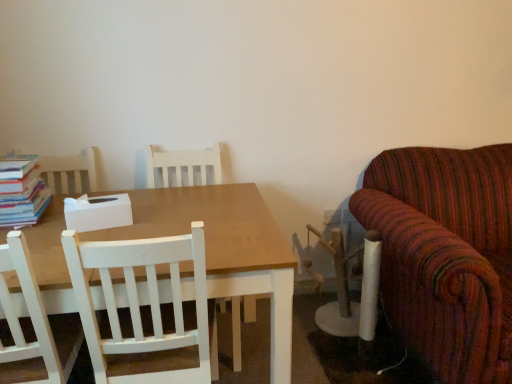
Locate an element on the screen. white wood chair at center, which is counted as the 2th chair, starting from the back is located at coordinates (146, 311).

This screenshot has width=512, height=384. What do you see at coordinates (22, 191) in the screenshot? I see `hardcover books at left` at bounding box center [22, 191].

The height and width of the screenshot is (384, 512). What do you see at coordinates (183, 164) in the screenshot?
I see `white wood chair at center, the first chair when ordered from back to front` at bounding box center [183, 164].

This screenshot has width=512, height=384. I want to click on white wood chair at center, marked as the first chair in a front-to-back arrangement, so click(x=146, y=311).

How distant is hardcover books at left from white wood chair at center, the second chair positioned from the front?

They are 23.54 inches apart.

Is hardcover books at left thinner than white wood chair at center, the first chair when ordered from back to front?

Yes, hardcover books at left is thinner than white wood chair at center, the first chair when ordered from back to front.

Is hardcover books at left oriented towards white wood chair at center, the first chair when ordered from back to front?

Yes, hardcover books at left is aimed at white wood chair at center, the first chair when ordered from back to front.

Is hardcover books at left behind white wood chair at center, the first chair when ordered from back to front?

No, hardcover books at left is closer to the viewer.

Considering the relative sizes of white wood chair at center, which is counted as the 2th chair, starting from the back, and white wood chair at center, the second chair positioned from the front, in the image provided, is white wood chair at center, which is counted as the 2th chair, starting from the back, shorter than white wood chair at center, the second chair positioned from the front,?

Yes, white wood chair at center, which is counted as the 2th chair, starting from the back, is shorter than white wood chair at center, the second chair positioned from the front.

Which is more to the left, white wood chair at center, marked as the first chair in a front-to-back arrangement, or white wood chair at center, the second chair positioned from the front?

From the viewer's perspective, white wood chair at center, marked as the first chair in a front-to-back arrangement, appears more on the left side.

Which object is further away from the camera, white wood chair at center, which is counted as the 2th chair, starting from the back, or white wood chair at center, the first chair when ordered from back to front?

white wood chair at center, the first chair when ordered from back to front, is further from the camera.

Is matte wooden table at center oriented away from white wood chair at center, which is counted as the 2th chair, starting from the back?

Absolutely, matte wooden table at center is directed away from white wood chair at center, which is counted as the 2th chair, starting from the back.

From the image's perspective, is matte wooden table at center located above or below white wood chair at center, which is counted as the 2th chair, starting from the back?

matte wooden table at center is situated lower than white wood chair at center, which is counted as the 2th chair, starting from the back, in the image.

Between point (85, 240) and point (104, 368), which one is positioned behind?

The point (104, 368) is behind.

Between hardcover books at left and matte wooden table at center, which one has larger size?

matte wooden table at center.

Is hardcover books at left facing towards matte wooden table at center?

No, hardcover books at left is not oriented towards matte wooden table at center.

Can you confirm if white wood chair at center, which is counted as the 2th chair, starting from the back, is wider than hardcover books at left?

Yes.

Between white wood chair at center, marked as the first chair in a front-to-back arrangement, and hardcover books at left, which one has less height?

Standing shorter between the two is hardcover books at left.

Is point (192, 239) positioned behind point (22, 181)?

No, (192, 239) is in front of (22, 181).

From a real-world perspective, which object stands above the other?

In real-world perspective, hardcover books at left is above.

Is white wood chair at center, the second chair positioned from the front, directly adjacent to hardcover books at left?

white wood chair at center, the second chair positioned from the front, is not next to hardcover books at left, and they're not touching.

Can hardcover books at left be found inside white wood chair at center, the second chair positioned from the front?

No, white wood chair at center, the second chair positioned from the front, does not contain hardcover books at left.

Is point (215, 162) positioned after point (35, 169)?

That is True.

The width and height of the screenshot is (512, 384). In order to click on book above the white wood chair at center, the first chair when ordered from back to front (from a real-world perspective) in this screenshot , I will do `click(22, 191)`.

From a real-world perspective, who is located lower, white wood chair at center, the first chair when ordered from back to front, or matte wooden table at center?

In real-world perspective, matte wooden table at center is lower.

Could matte wooden table at center be considered to be inside white wood chair at center, the first chair when ordered from back to front?

Actually, matte wooden table at center is outside white wood chair at center, the first chair when ordered from back to front.

Measure the distance from white wood chair at center, the first chair when ordered from back to front, to matte wooden table at center.

22.68 inches.

Between white wood chair at center, the first chair when ordered from back to front, and matte wooden table at center, which one has larger width?

Wider between the two is matte wooden table at center.

Find the location of a particular element. the 2nd chair to the right when counting from the hardcover books at left is located at coordinates (183, 164).

Locate an element on the screen. chair lying below the white wood chair at center, the first chair when ordered from back to front (from the image's perspective) is located at coordinates (146, 311).

From the image, which object appears to be farther from white wood chair at center, the first chair when ordered from back to front, hardcover books at left or white wood chair at center, marked as the first chair in a front-to-back arrangement?

white wood chair at center, marked as the first chair in a front-to-back arrangement.

Based on their spatial positions, is white wood chair at center, the first chair when ordered from back to front, or matte wooden table at center closer to white wood chair at center, which is counted as the 2th chair, starting from the back?

matte wooden table at center lies closer to white wood chair at center, which is counted as the 2th chair, starting from the back, than the other object.

From the image, which object appears to be farther from white wood chair at center, which is counted as the 2th chair, starting from the back, matte wooden table at center or white wood chair at center, the first chair when ordered from back to front?

white wood chair at center, the first chair when ordered from back to front.

Based on their spatial positions, is matte wooden table at center or hardcover books at left further from white wood chair at center, the second chair positioned from the front?

Based on the image, hardcover books at left appears to be further to white wood chair at center, the second chair positioned from the front.

Considering their positions, is matte wooden table at center positioned further to white wood chair at center, which is counted as the 2th chair, starting from the back, than hardcover books at left?

Among the two, hardcover books at left is located further to white wood chair at center, which is counted as the 2th chair, starting from the back.

Considering their positions, is white wood chair at center, marked as the first chair in a front-to-back arrangement, positioned closer to hardcover books at left than white wood chair at center, the second chair positioned from the front?

white wood chair at center, the second chair positioned from the front.

From the image, which object appears to be farther from hardcover books at left, matte wooden table at center or white wood chair at center, marked as the first chair in a front-to-back arrangement?

Among the two, white wood chair at center, marked as the first chair in a front-to-back arrangement, is located further to hardcover books at left.

When comparing their distances from white wood chair at center, the first chair when ordered from back to front, does white wood chair at center, marked as the first chair in a front-to-back arrangement, or matte wooden table at center seem further?

white wood chair at center, marked as the first chair in a front-to-back arrangement, is further to white wood chair at center, the first chair when ordered from back to front.

Locate an element on the screen. table between white wood chair at center, which is counted as the 2th chair, starting from the back, and white wood chair at center, the second chair positioned from the front, from front to back is located at coordinates (225, 248).

Locate an element on the screen. This screenshot has width=512, height=384. table situated between hardcover books at left and white wood chair at center, which is counted as the 2th chair, starting from the back, from left to right is located at coordinates (225, 248).

Locate an element on the screen. chair between hardcover books at left and white wood chair at center, the first chair when ordered from back to front, from left to right is located at coordinates (146, 311).

The width and height of the screenshot is (512, 384). I want to click on table between hardcover books at left and white wood chair at center, the second chair positioned from the front, from left to right, so click(225, 248).